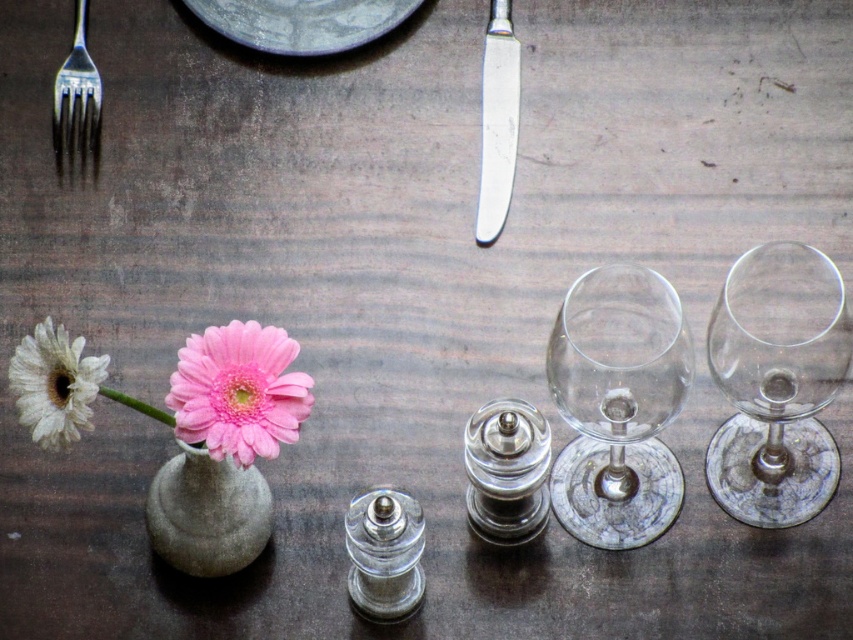
Is matte gray vase at lower left to the left of clear glass bottle at center from the viewer's perspective?

Correct, you'll find matte gray vase at lower left to the left of clear glass bottle at center.

Does point (209, 509) lie behind point (401, 614)?

That is False.

At what (x,y) coordinates should I click in order to perform the action: click on matte gray vase at lower left. Please return your answer as a coordinate pair (x, y). This screenshot has width=853, height=640. Looking at the image, I should click on (207, 513).

Is clear glass bottle at center above white matte flower at left?

Incorrect, clear glass bottle at center is not positioned above white matte flower at left.

The width and height of the screenshot is (853, 640). I want to click on clear glass bottle at center, so click(x=384, y=554).

Can you confirm if metallic silver plate at upper center is shorter than clear glass bottle at center?

Indeed, metallic silver plate at upper center has a lesser height compared to clear glass bottle at center.

Between metallic silver plate at upper center and clear glass bottle at center, which one is positioned higher?

metallic silver plate at upper center

Between point (398, 22) and point (346, 522), which one is positioned in front?

Point (346, 522) is in front.

Where is `metallic silver plate at upper center`? metallic silver plate at upper center is located at coordinates (302, 22).